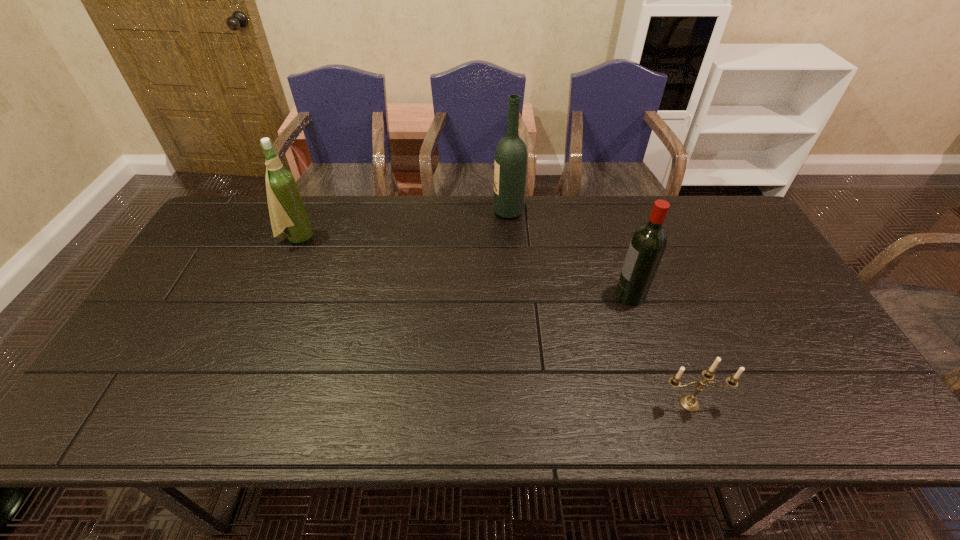
Where is `vacant point located between the second wine bottle from left to right and the nearest wine bottle`? vacant point located between the second wine bottle from left to right and the nearest wine bottle is located at coordinates (569, 253).

I want to click on blank region between the second object from left to right and the second farthest object, so click(402, 225).

Select which object appears as the closest to the shortest object. Please provide its 2D coordinates. Your answer should be formatted as a tuple, i.e. [(x, y)], where the tuple contains the x and y coordinates of a point satisfying the conditions above.

[(648, 243)]

Identify which object is located as the second nearest to the nearest object. Please provide its 2D coordinates. Your answer should be formatted as a tuple, i.e. [(x, y)], where the tuple contains the x and y coordinates of a point satisfying the conditions above.

[(510, 166)]

This screenshot has height=540, width=960. Identify the location of wine bottle that is the second nearest to the farthest object. (287, 211).

Identify which wine bottle is the second nearest to the candle. Please provide its 2D coordinates. Your answer should be formatted as a tuple, i.e. [(x, y)], where the tuple contains the x and y coordinates of a point satisfying the conditions above.

[(510, 166)]

Locate an element on the screen. vacant point that satisfies the following two spatial constraints: 1. on the label of the nearest wine bottle; 2. on the back side of the candle is located at coordinates (664, 403).

This screenshot has width=960, height=540. Identify the location of vacant space that satisfies the following two spatial constraints: 1. on the label of the nearest object; 2. on the left side of the rightmost wine bottle. (664, 403).

What are the coordinates of `free spot that satisfies the following two spatial constraints: 1. on the back side of the candle; 2. on the labeled side of the farthest object` in the screenshot? It's located at (620, 212).

Identify the location of vacant space that satisfies the following two spatial constraints: 1. on the label of the rightmost wine bottle; 2. on the left side of the nearest object. The height and width of the screenshot is (540, 960). (664, 403).